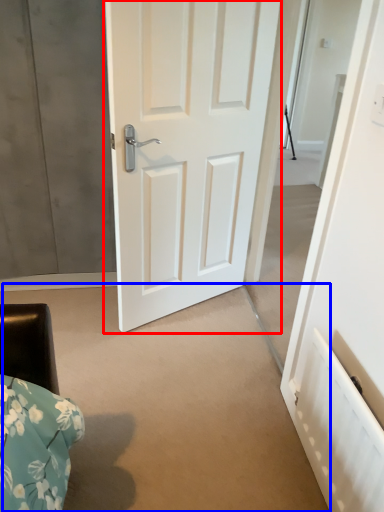
Question: Which point is further to the camera, door (highlighted by a red box) or concrete (highlighted by a blue box)?

Choices:
 (A) door
 (B) concrete

Answer: (A)